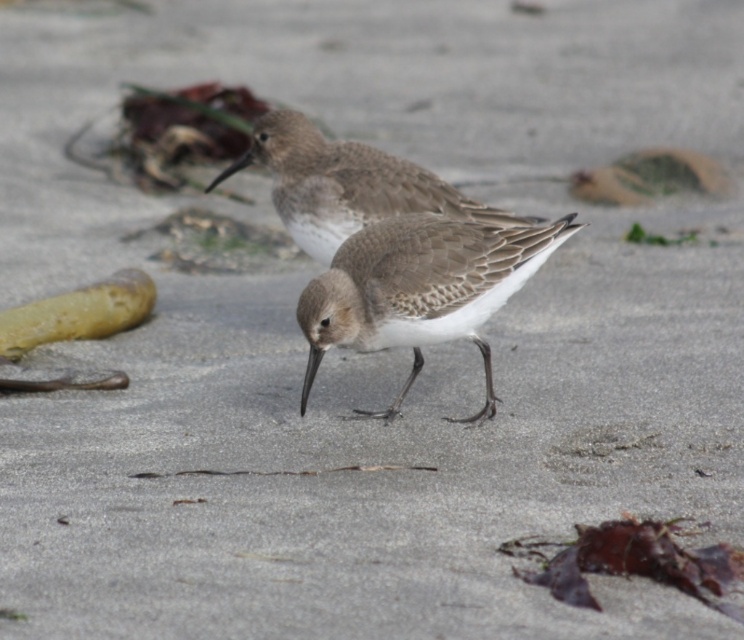
Question: Considering the relative positions of brown speckled sandpiper at center and brown feathered bird at center in the image provided, where is brown speckled sandpiper at center located with respect to brown feathered bird at center?

Choices:
 (A) left
 (B) right

Answer: (B)

Question: Which point is closer to the camera?

Choices:
 (A) (272, 115)
 (B) (385, 324)

Answer: (B)

Question: Is brown speckled sandpiper at center above brown feathered bird at center?

Choices:
 (A) no
 (B) yes

Answer: (A)

Question: Which point is closer to the camera?

Choices:
 (A) (307, 196)
 (B) (304, 324)

Answer: (B)

Question: Does brown speckled sandpiper at center lie behind brown feathered bird at center?

Choices:
 (A) no
 (B) yes

Answer: (A)